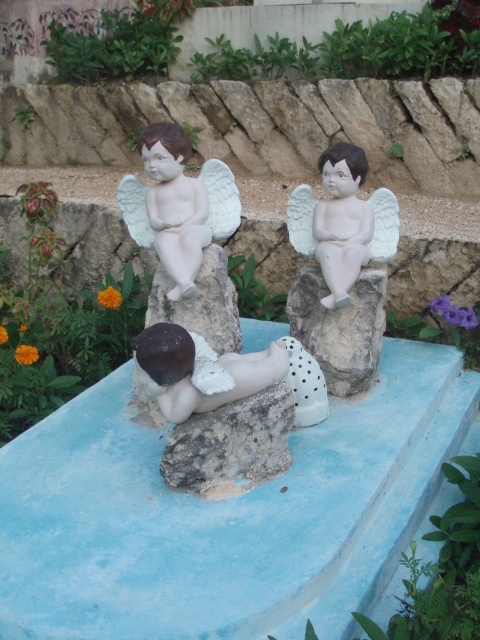
Question: Is white matte angel at upper left thinner than gray rough stone at center?

Choices:
 (A) no
 (B) yes

Answer: (A)

Question: Does white matte angel at upper left have a smaller size compared to white matte stone at upper right?

Choices:
 (A) no
 (B) yes

Answer: (A)

Question: Is white matte angel at center further to the viewer compared to gray rough stone at center?

Choices:
 (A) no
 (B) yes

Answer: (B)

Question: Which object is the farthest from the white matte angel at upper left?

Choices:
 (A) gray rough stone at center
 (B) white matte angel at center
 (C) white matte stone at upper right

Answer: (A)

Question: Which is nearer to the white matte angel at center?

Choices:
 (A) white matte stone at upper right
 (B) gray rough stone at center
 (C) white matte angel at upper left

Answer: (A)

Question: Which object appears closest to the camera in this image?

Choices:
 (A) white matte angel at center
 (B) gray rough stone at center
 (C) white matte stone at upper right

Answer: (B)